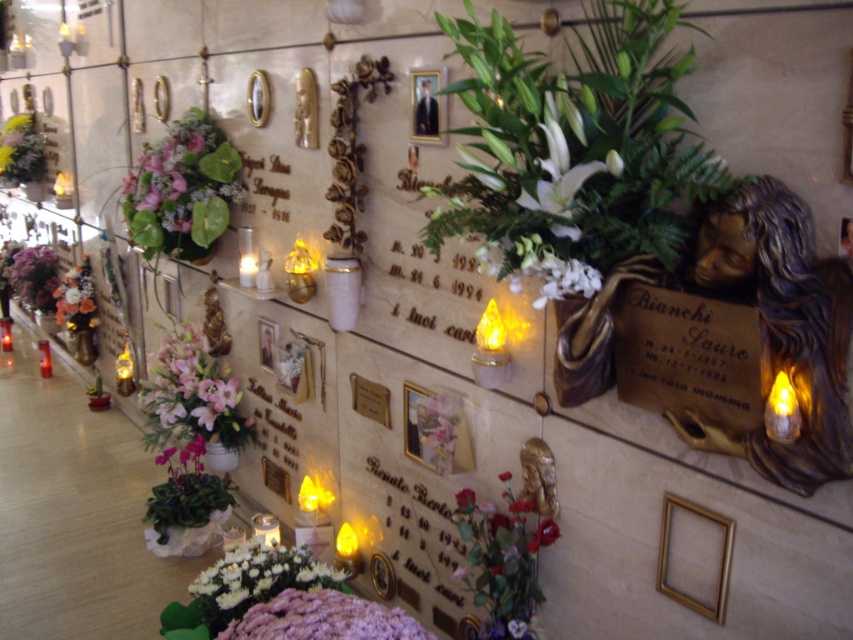
You are visiting a cemetery and see the white matte flowers at center and the gold metallic picture frame at center on a memorial wall. Which object is located to the right of the other?

The white matte flowers at center are positioned on the right side of the gold metallic picture frame at center.

Looking at this image, you are a maintenance worker assigned to clean the cemetery wall. You have a 1.5 meter long pole tool. You need to reach both the white glossy flowers at upper center and the matte gold picture frame at center. Can you clean both with the same pole tool?

The white glossy flowers at upper center is 1.49 meters from matte gold picture frame at center. Since the distance between them is less than the pole tool length, you can clean both with the same pole tool.

You are standing in front of the cemetery wall and want to place a small vase of flowers exactly 1 meter away from where you are standing. Can you place it at the location of the white matte flowers at center?

The white matte flowers at center are 1.37 meters away from the viewer, which is further than 1 meter, so placing the vase there would not meet the requirement of being exactly 1 meter away.